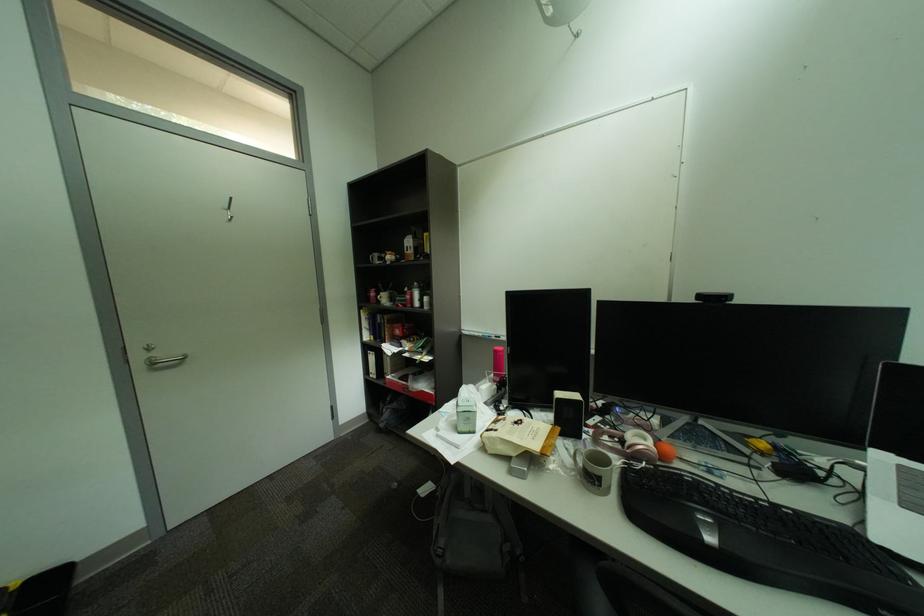
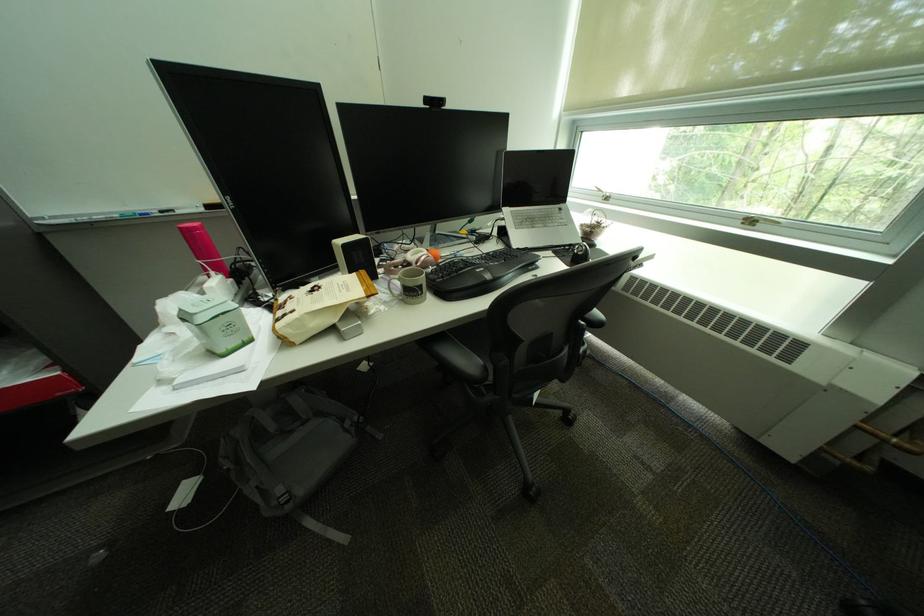
In the second image, find the point that corresponds to point (627, 440) in the first image.

(410, 268)